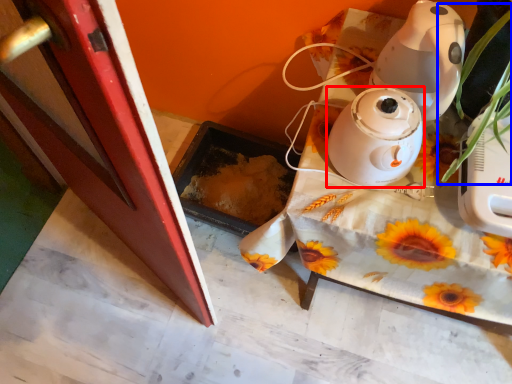
Question: Which of the following is the farthest to the observer, home appliance (highlighted by a red box) or plant (highlighted by a blue box)?

Choices:
 (A) home appliance
 (B) plant

Answer: (A)